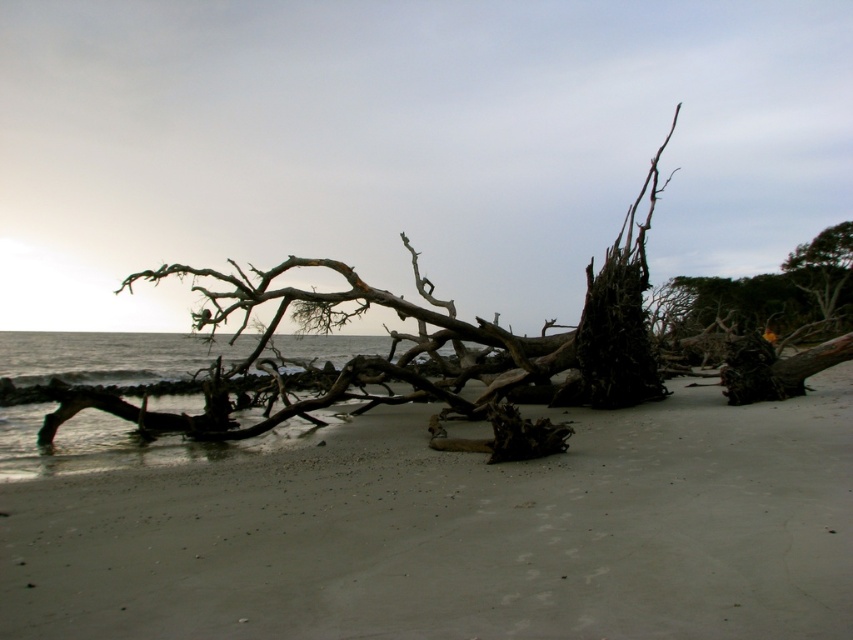
Question: Can you confirm if gray sand at center is wider than green leafy tree at upper right?

Choices:
 (A) no
 (B) yes

Answer: (A)

Question: Does gray sand at center appear on the left side of green leafy tree at upper right?

Choices:
 (A) yes
 (B) no

Answer: (A)

Question: Can you confirm if gray sand at center is smaller than green leafy tree at upper right?

Choices:
 (A) no
 (B) yes

Answer: (B)